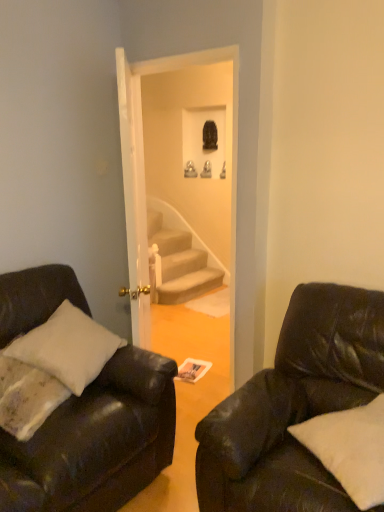
Question: From the image's perspective, relative to white soft pillow at lower right, is black leather couch at right, acting as the 2th studio couch starting from the left, above or below?

Choices:
 (A) above
 (B) below

Answer: (B)

Question: Relative to white soft pillow at lower right, is black leather couch at right, acting as the 2th studio couch starting from the left, in front or behind?

Choices:
 (A) front
 (B) behind

Answer: (A)

Question: Estimate the real-world distances between objects in this image. Which object is closer to the white soft pillow at lower right?

Choices:
 (A) black leather couch at right, acting as the 2th studio couch starting from the left
 (B) matte black couch at left, the 1th studio couch from the left

Answer: (A)

Question: Considering the real-world distances, which object is farthest from the matte black couch at left, the 2th studio couch when ordered from right to left?

Choices:
 (A) white soft pillow at lower right
 (B) black leather couch at right, acting as the 2th studio couch starting from the left

Answer: (A)